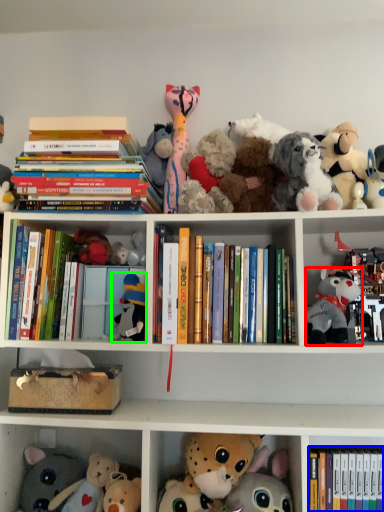
Question: Estimate the real-world distances between objects in this image. Which object is closer to toy (highlighted by a red box), book (highlighted by a blue box) or toy (highlighted by a green box)?

Choices:
 (A) book
 (B) toy

Answer: (A)